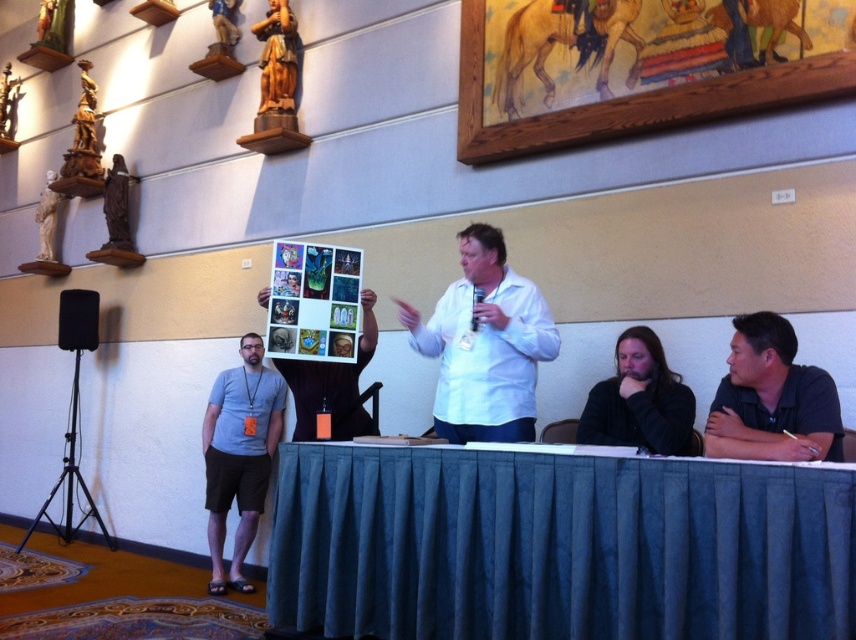
Does point (265, 456) come behind point (62, 312)?

No.

Is gray fabric shorts at lower left wider than black matte speaker at left?

Correct, the width of gray fabric shorts at lower left exceeds that of black matte speaker at left.

Which is behind, point (241, 461) or point (93, 340)?

The point (93, 340) is behind.

Identify the location of gray fabric shorts at lower left. This screenshot has height=640, width=856. pyautogui.click(x=239, y=454).

Where is `white matte shirt at center`? The width and height of the screenshot is (856, 640). white matte shirt at center is located at coordinates (484, 344).

Is white matte shirt at center further to camera compared to black matte speaker at left?

No, it is not.

Which is behind, point (530, 420) or point (58, 324)?

The point (58, 324) is behind.

Identify the location of white matte shirt at center. (484, 344).

Is point (803, 544) positioned behind point (272, 20)?

No, (803, 544) is closer to viewer.

Does blue fabric table at lower center appear on the left side of wooden statue at upper left?

Incorrect, blue fabric table at lower center is not on the left side of wooden statue at upper left.

Who is more distant from viewer, (443, 451) or (278, 17)?

Positioned behind is point (278, 17).

At what (x,y) coordinates should I click in order to perform the action: click on blue fabric table at lower center. Please return your answer as a coordinate pair (x, y). The height and width of the screenshot is (640, 856). Looking at the image, I should click on (557, 547).